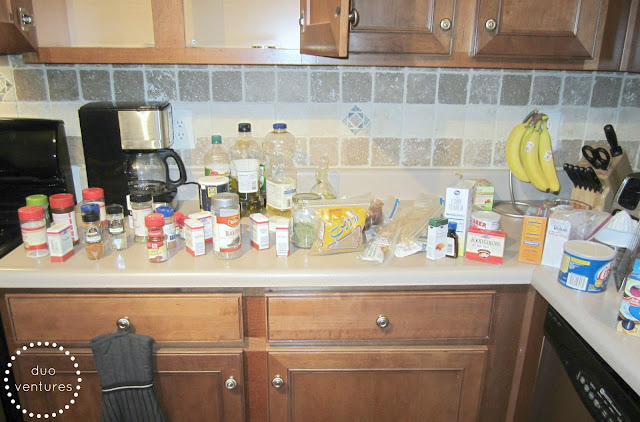
Where is `cabinet knob`? The height and width of the screenshot is (422, 640). cabinet knob is located at coordinates pos(450,25), pos(489,24), pos(379,324), pos(278,381), pos(232,384), pos(124,325).